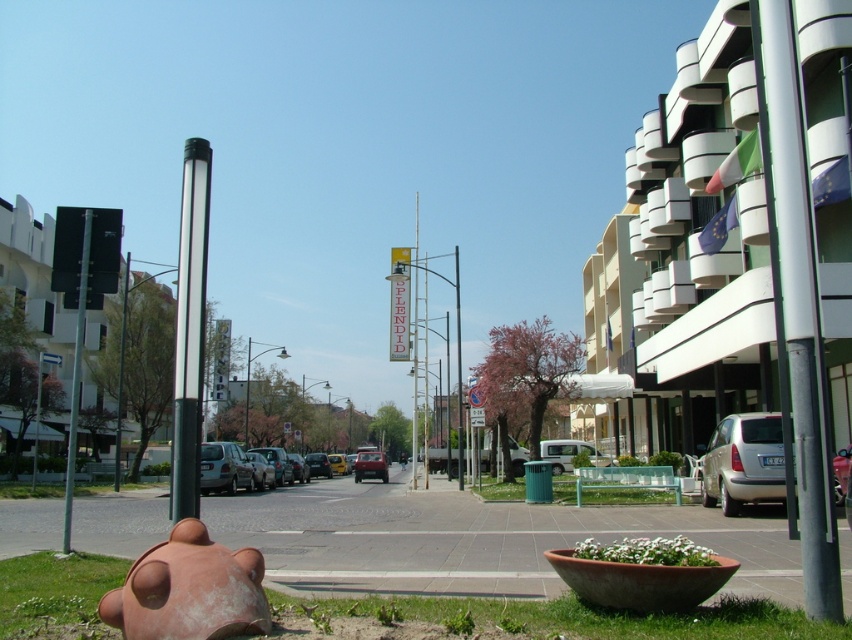
Question: Estimate the real-world distances between objects in this image. Which object is closer to the matte silver car at center?

Choices:
 (A) polished metal pole at center
 (B) silver metallic van at center

Answer: (B)

Question: Which of the following is the closest to the observer?

Choices:
 (A) (355, 454)
 (B) (200, 483)

Answer: (B)

Question: Which point is farther to the camera?

Choices:
 (A) silver metallic van at center
 (B) polished metal pole at center
 (C) white matte van at center

Answer: (C)

Question: Is the position of silver metallic van at lower right more distant than that of matte silver car at center?

Choices:
 (A) yes
 (B) no

Answer: (B)

Question: Where is smooth concrete pavement at center located in relation to matte silver car at center in the image?

Choices:
 (A) below
 (B) above

Answer: (A)

Question: Is silver metallic van at lower right positioned behind silver metallic van at center?

Choices:
 (A) yes
 (B) no

Answer: (B)